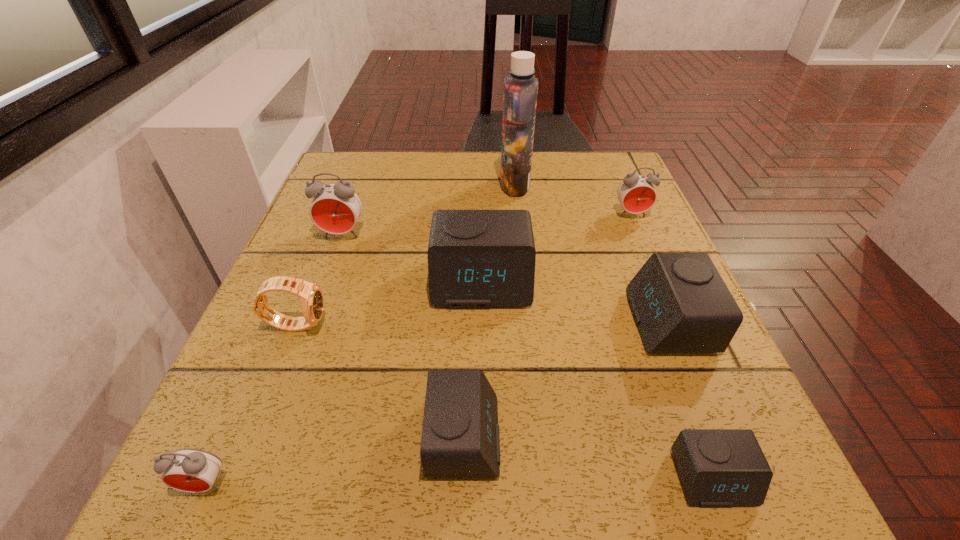
I want to click on the farthest object, so click(520, 87).

Identify the location of shampoo. (520, 87).

Identify the location of the tallest alarm clock. This screenshot has height=540, width=960. click(336, 207).

The width and height of the screenshot is (960, 540). Find the location of `the biggest red alarm clock`. the biggest red alarm clock is located at coordinates (336, 207).

Locate an element on the screen. the second farthest object is located at coordinates (636, 193).

At what (x,y) coordinates should I click in order to perform the action: click on the farthest red alarm clock. Please return your answer as a coordinate pair (x, y). The height and width of the screenshot is (540, 960). Looking at the image, I should click on (636, 193).

Find the location of a particular element. the biggest black alarm clock is located at coordinates (476, 258).

Find the location of `black watch`. black watch is located at coordinates (311, 296).

Where is `the third smallest black alarm clock`? the third smallest black alarm clock is located at coordinates click(x=680, y=303).

Where is `the nearest red alarm clock`? The width and height of the screenshot is (960, 540). the nearest red alarm clock is located at coordinates (191, 470).